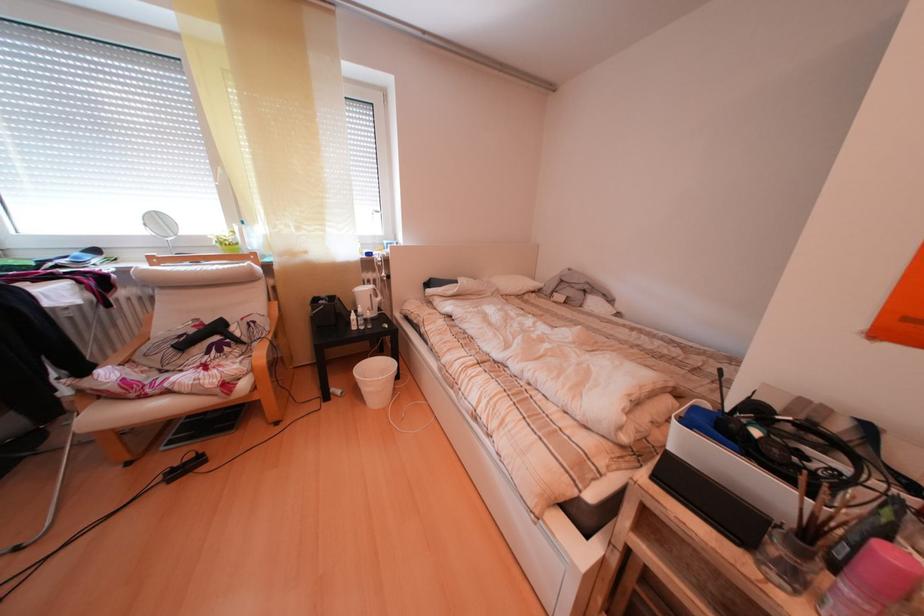
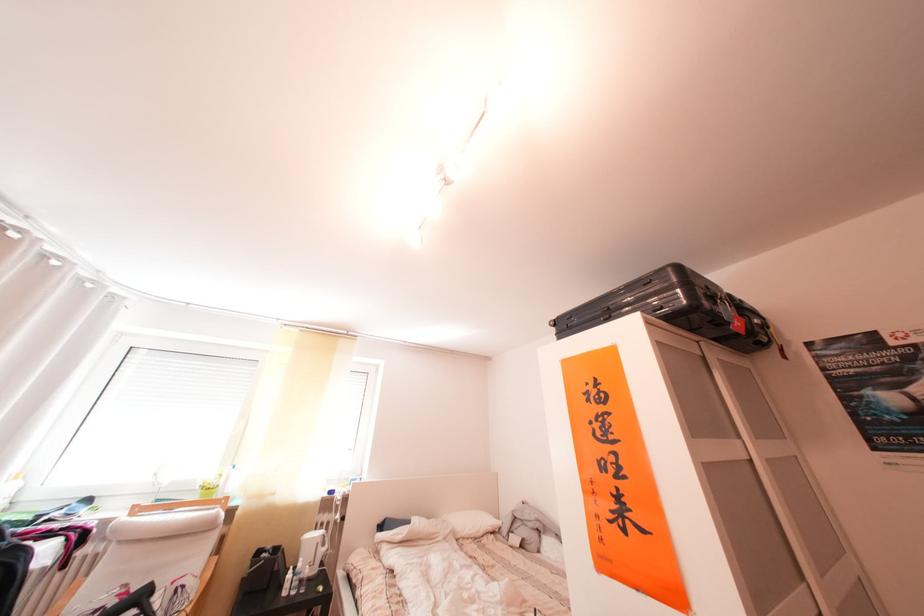
Where in the second image is the point corresponding to the point at 371,315 from the first image?

(312, 570)